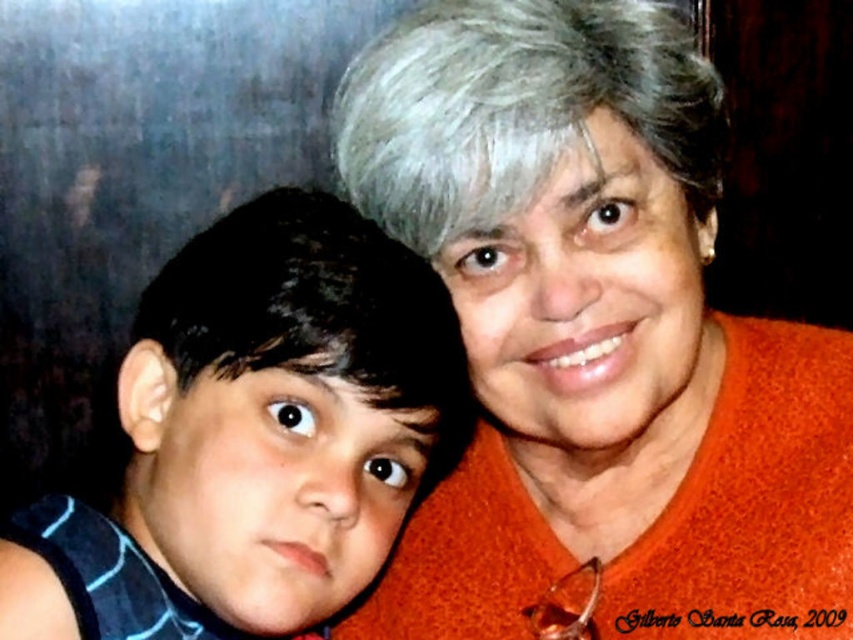
Question: Can you confirm if orange fabric at upper right is wider than gray matte hair at upper center?

Choices:
 (A) no
 (B) yes

Answer: (B)

Question: Which of the following is the farthest from the observer?

Choices:
 (A) gray matte hair at upper center
 (B) blue striped shirt at left
 (C) orange fabric at upper right

Answer: (C)

Question: Which is farther from the gray matte hair at upper center?

Choices:
 (A) orange fabric at upper right
 (B) blue striped shirt at left

Answer: (B)

Question: Does orange fabric at upper right have a smaller size compared to blue striped shirt at left?

Choices:
 (A) no
 (B) yes

Answer: (A)

Question: Which of the following is the farthest from the observer?

Choices:
 (A) orange fabric at upper right
 (B) gray matte hair at upper center
 (C) blue striped shirt at left

Answer: (A)

Question: Is the position of blue striped shirt at left more distant than that of gray matte hair at upper center?

Choices:
 (A) yes
 (B) no

Answer: (B)